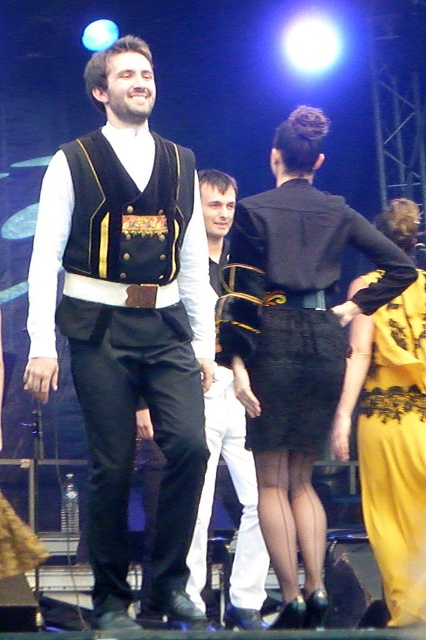
Can you confirm if black lace skirt at center is positioned below white cotton pants at center?

No, black lace skirt at center is not below white cotton pants at center.

Is point (376, 291) positioned behind point (253, 577)?

No, it is in front of (253, 577).

This screenshot has width=426, height=640. What are the coordinates of `black lace skirt at center` in the screenshot? It's located at (296, 307).

Is point (380, 401) positioned after point (230, 209)?

No, (380, 401) is closer to viewer.

Can you confirm if yellow lace dress at right is positioned to the right of white cotton pants at center?

Correct, you'll find yellow lace dress at right to the right of white cotton pants at center.

You are a GUI agent. You are given a task and a screenshot of the screen. Output one action in this format:
    pyautogui.click(x=<x>, y=<y>)
    Task: Click on the yellow lace dress at right
    Image resolution: width=426 pixels, height=640 pixels.
    Given the screenshot: What is the action you would take?
    pyautogui.click(x=391, y=442)

Locate an element on the screen. yellow lace dress at right is located at coordinates (391, 442).

Which is below, matte black vest at center or black lace skirt at center?

matte black vest at center

Is matte black vest at center thinner than black lace skirt at center?

Yes, matte black vest at center is thinner than black lace skirt at center.

Which is behind, point (129, 387) or point (287, 225)?

The point (287, 225) is more distant.

This screenshot has height=640, width=426. I want to click on matte black vest at center, so tap(127, 387).